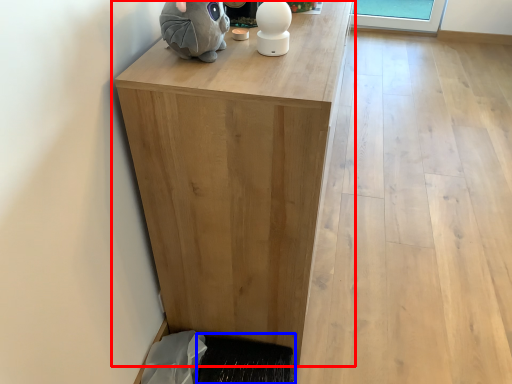
Question: Among these objects, which one is farthest to the camera, table (highlighted by a red box) or doormat (highlighted by a blue box)?

Choices:
 (A) table
 (B) doormat

Answer: (B)